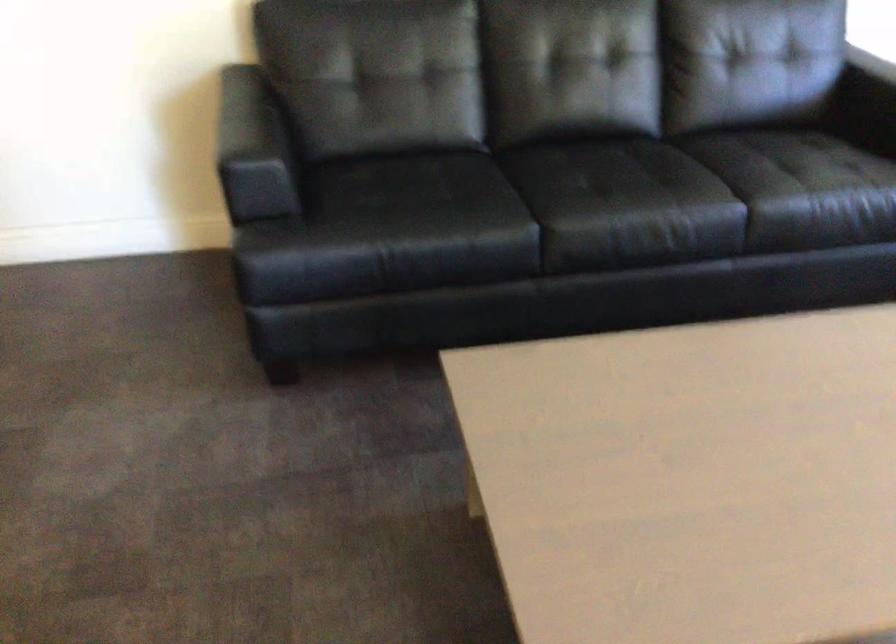
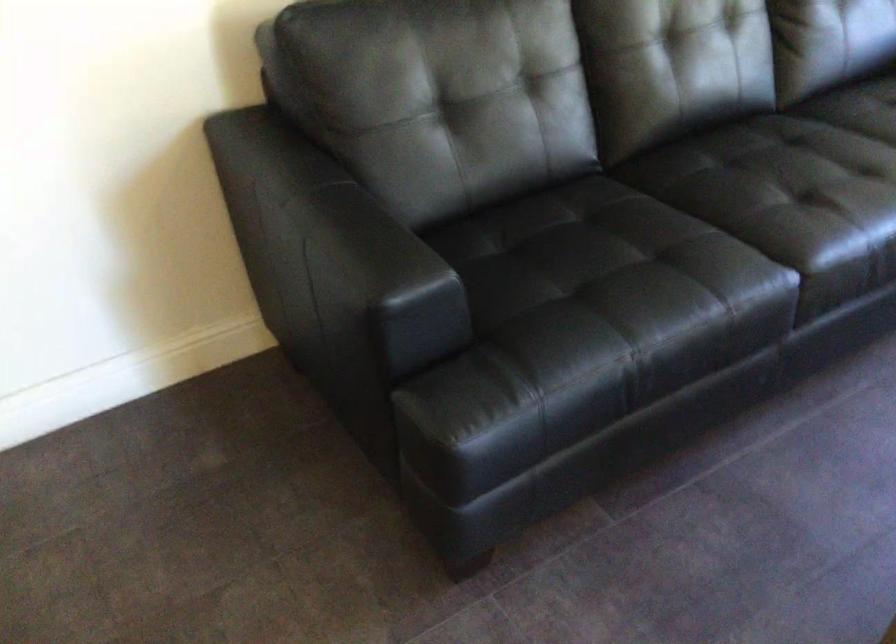
In a continuous first-person perspective shot, in which direction is the camera moving?

The movement direction of the cameraman is left, forward.